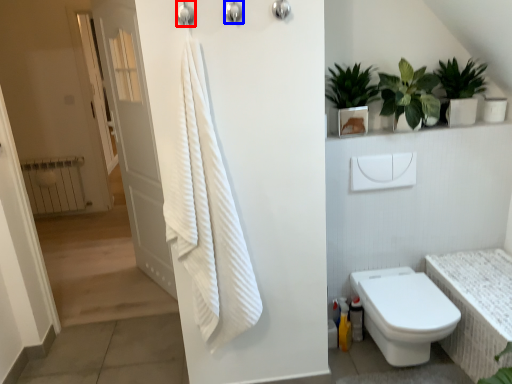
Question: Which point is closer to the camera, shower (highlighted by a red box) or shower (highlighted by a blue box)?

Choices:
 (A) shower
 (B) shower

Answer: (A)